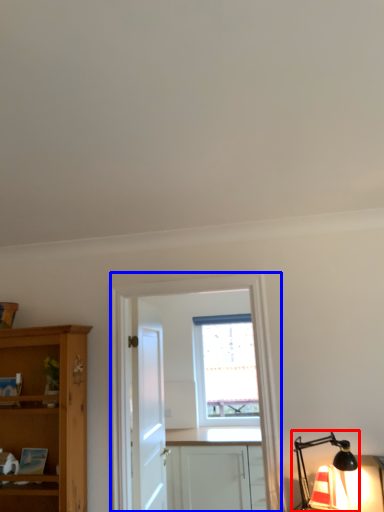
Question: Which object appears farthest to the camera in this image, light fixture (highlighted by a red box) or entertainment center (highlighted by a blue box)?

Choices:
 (A) light fixture
 (B) entertainment center

Answer: (B)